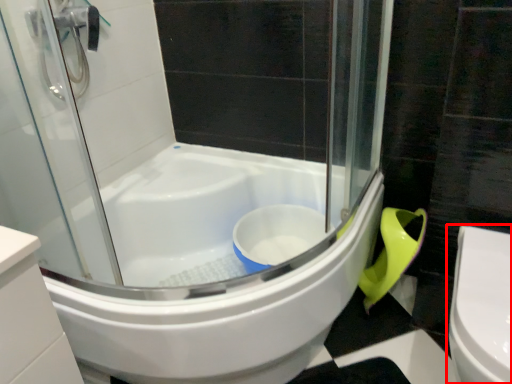
Question: From the image, what is the correct spatial relationship of toilet (annotated by the red box) in relation to bathtub?

Choices:
 (A) left
 (B) right

Answer: (B)